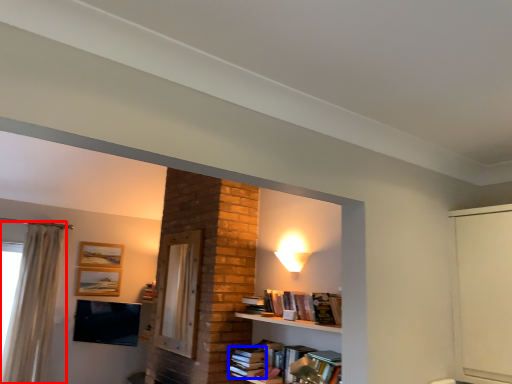
Question: Which point is closer to the camera, curtain (highlighted by a red box) or book (highlighted by a blue box)?

Choices:
 (A) curtain
 (B) book

Answer: (B)